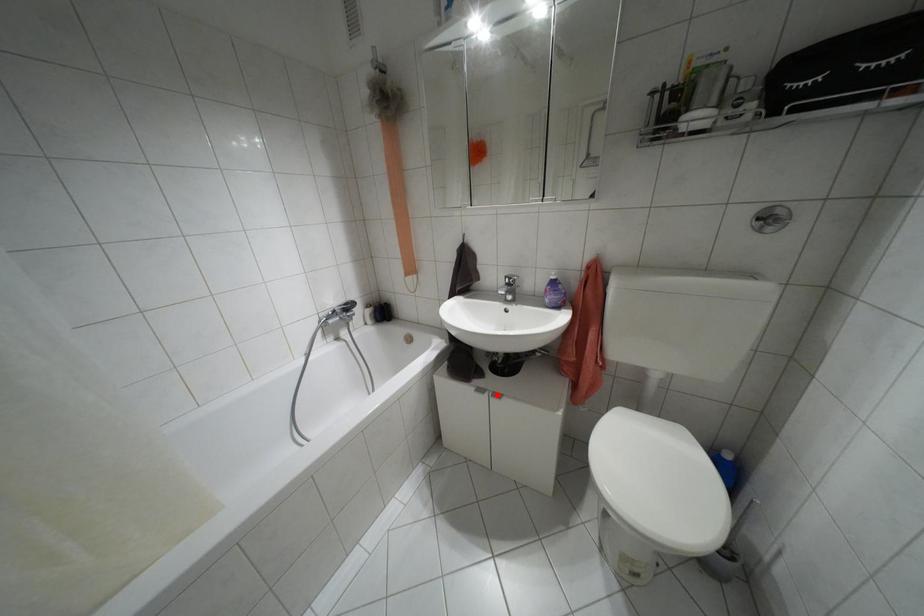
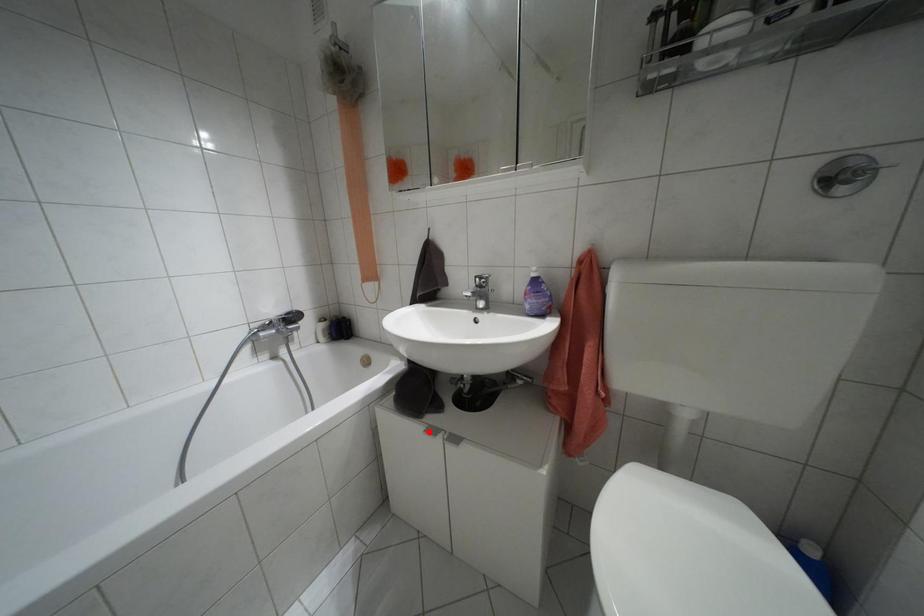
I am providing you with two images of the same scene from different viewpoints. A red point is marked on the first image and another point is marked on the second image. Is the red point in image1 aligned with the point shown in image2?

No